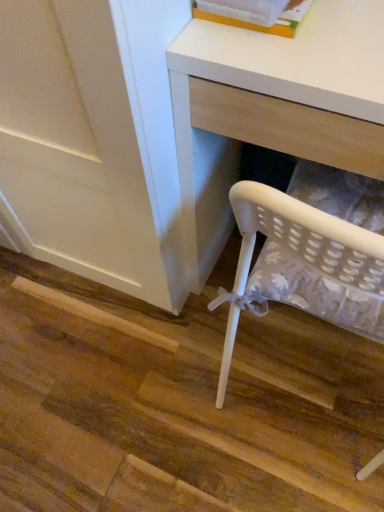
Where is `white plastic book at upper center`? The width and height of the screenshot is (384, 512). white plastic book at upper center is located at coordinates (260, 25).

Describe the element at coordinates (260, 25) in the screenshot. The width and height of the screenshot is (384, 512). I see `white plastic book at upper center` at that location.

What do you see at coordinates (272, 108) in the screenshot? This screenshot has width=384, height=512. I see `white matte desk at lower right` at bounding box center [272, 108].

In order to face white matte desk at lower right, should I rotate leftwards or rightwards?

Turn right by 17.126 degrees to look at white matte desk at lower right.

Identify the location of white matte desk at lower right. The width and height of the screenshot is (384, 512). (272, 108).

Where is `white plastic book at upper center`? The width and height of the screenshot is (384, 512). white plastic book at upper center is located at coordinates (260, 25).

Considering the relative positions of white plastic book at upper center and white matte desk at lower right in the image provided, is white plastic book at upper center to the left or to the right of white matte desk at lower right?

white plastic book at upper center is to the left of white matte desk at lower right.

Which is in front, white plastic book at upper center or white matte desk at lower right?

white matte desk at lower right is in front.

Does point (241, 26) come farther from viewer compared to point (201, 160)?

No, it is in front of (201, 160).

From the image's perspective, is white plastic book at upper center located above or below white matte desk at lower right?

Clearly, from the image's perspective, white plastic book at upper center is above white matte desk at lower right.

From a real-world perspective, which object stands above the other?

In real-world perspective, white plastic book at upper center is above.

Considering the sizes of objects white plastic book at upper center and white matte desk at lower right in the image provided, who is wider, white plastic book at upper center or white matte desk at lower right?

Wider between the two is white matte desk at lower right.

Can you confirm if white plastic book at upper center is taller than white matte desk at lower right?

Incorrect, the height of white plastic book at upper center is not larger of that of white matte desk at lower right.

Considering the sizes of objects white plastic book at upper center and white matte desk at lower right in the image provided, who is bigger, white plastic book at upper center or white matte desk at lower right?

With larger size is white matte desk at lower right.

Would you say white plastic book at upper center contains white matte desk at lower right?

That's incorrect, white matte desk at lower right is not inside white plastic book at upper center.

Is white plastic book at upper center in contact with white matte desk at lower right?

white plastic book at upper center and white matte desk at lower right are clearly separated.

Is white matte desk at lower right at the back of white plastic book at upper center?

No, white matte desk at lower right is not at the back of white plastic book at upper center.

Can you tell me how much white plastic book at upper center and white matte desk at lower right differ in facing direction?

The angle between the facing direction of white plastic book at upper center and the facing direction of white matte desk at lower right is 5.36 degrees.

How far apart are white plastic book at upper center and white matte desk at lower right?

white plastic book at upper center is 5.35 inches from white matte desk at lower right.

At what (x,y) coordinates should I click in order to perform the action: click on book on the left of white matte desk at lower right. Please return your answer as a coordinate pair (x, y). This screenshot has height=512, width=384. Looking at the image, I should click on (260, 25).

Can you confirm if white matte desk at lower right is positioned to the left of white plastic book at upper center?

No, white matte desk at lower right is not to the left of white plastic book at upper center.

Is the depth of white matte desk at lower right greater than that of white plastic book at upper center?

No.

Does point (185, 87) come closer to viewer compared to point (273, 24)?

No, it is behind (273, 24).

From the image's perspective, would you say white matte desk at lower right is shown under white plastic book at upper center?

Yes.

From a real-world perspective, is white matte desk at lower right positioned above or below white plastic book at upper center?

white matte desk at lower right is below white plastic book at upper center.

Can you confirm if white matte desk at lower right is thinner than white plastic book at upper center?

No.

Looking at this image, which of these two, white matte desk at lower right or white plastic book at upper center, stands taller?

white matte desk at lower right is taller.

Who is bigger, white matte desk at lower right or white plastic book at upper center?

white matte desk at lower right is bigger.

Would you say white matte desk at lower right is inside or outside white plastic book at upper center?

white matte desk at lower right is outside white plastic book at upper center.

Based on the photo, is white matte desk at lower right next to white plastic book at upper center and touching it?

white matte desk at lower right is not next to white plastic book at upper center, and they're not touching.

Does white matte desk at lower right turn towards white plastic book at upper center?

No, white matte desk at lower right is not turned towards white plastic book at upper center.

The height and width of the screenshot is (512, 384). I want to click on book that is above the white matte desk at lower right (from the image's perspective), so click(260, 25).

In order to click on book lying behind the white matte desk at lower right in this screenshot , I will do `click(260, 25)`.

The height and width of the screenshot is (512, 384). Identify the location of desk in front of the white plastic book at upper center. (272, 108).